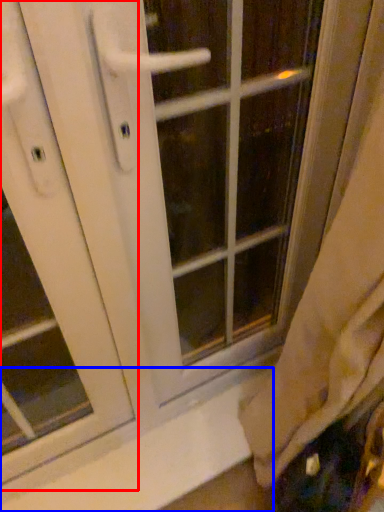
Question: Which object appears farthest to the camera in this image, screen door (highlighted by a red box) or window sill (highlighted by a blue box)?

Choices:
 (A) screen door
 (B) window sill

Answer: (B)